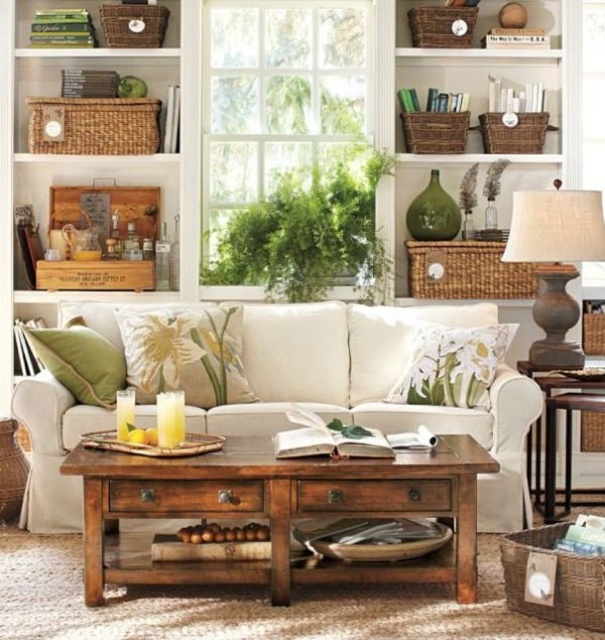
You are sitting on the cream sofa and want to grab the matte gray lamp at right to adjust the light. However, you also need to reach the green fabric pillow at left to fluff it. Which object will you need to stretch more to reach?

The green fabric pillow at left requires more stretching because it is closer to you than the matte gray lamp at right, which is further away.